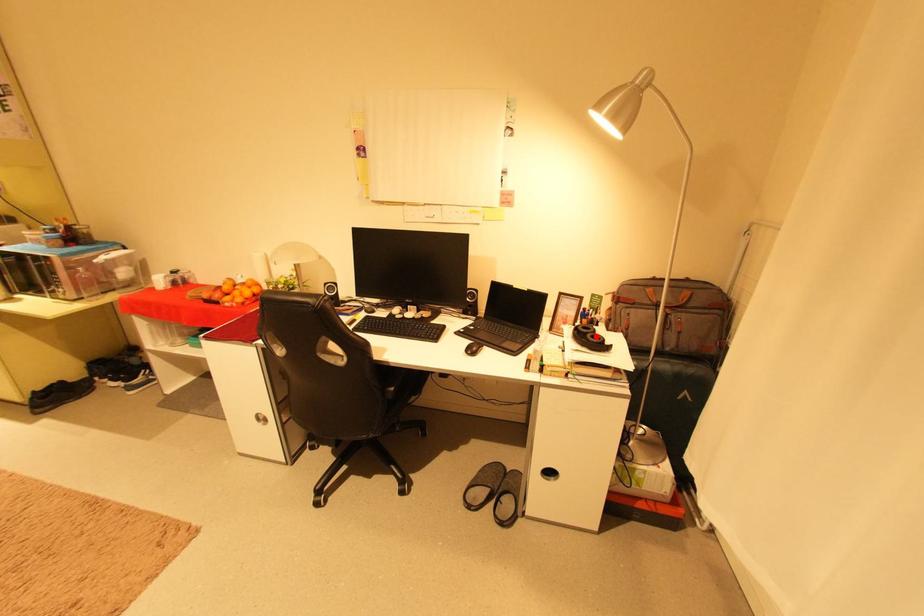
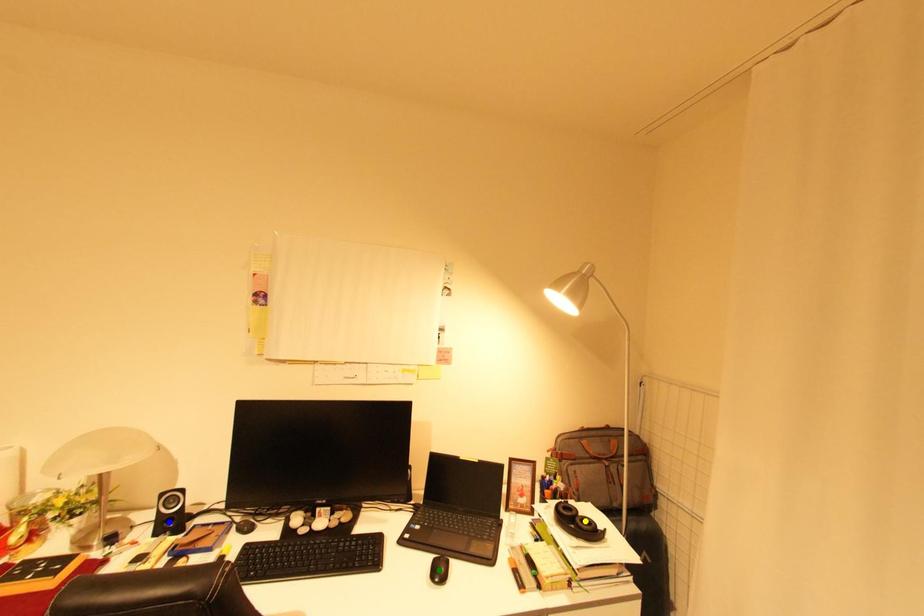
Question: I am providing you with two images of the same scene from different viewpoints. A red point is marked on the first image. You are given multiple points on the second image. Which point in image 2 is actually the same real-world point as the red point in image 1?

Choices:
 (A) blue point
 (B) green point
 (C) yellow point

Answer: (C)